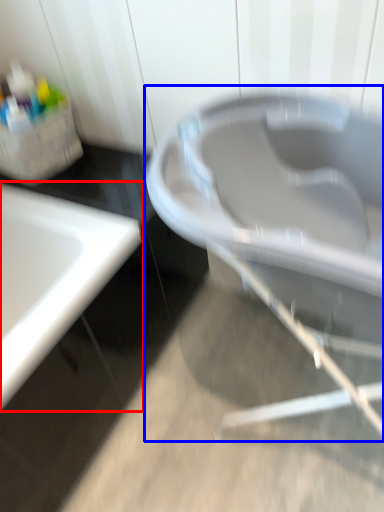
Question: Which of the following is the farthest to the observer, sink (highlighted by a red box) or bath (highlighted by a blue box)?

Choices:
 (A) sink
 (B) bath

Answer: (A)